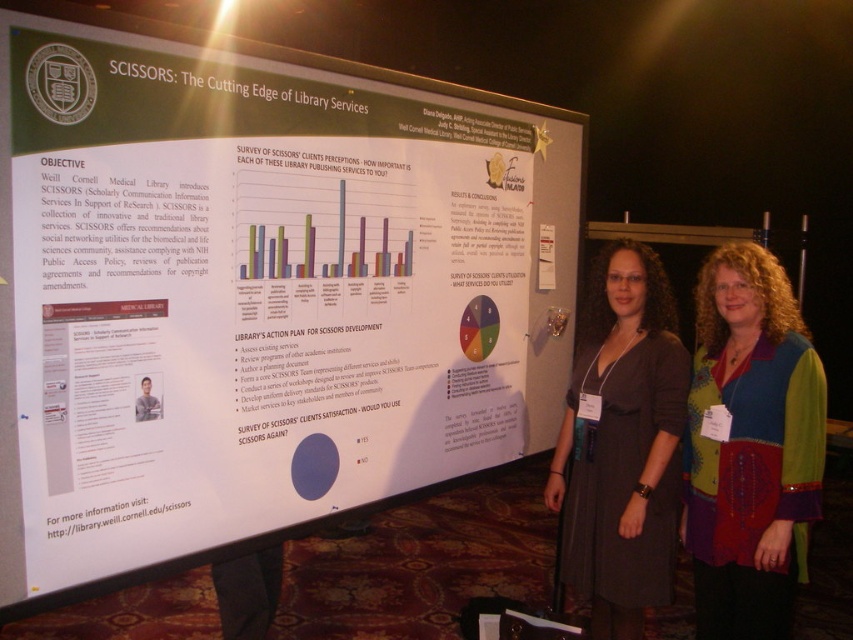
Question: Estimate the real-world distances between objects in this image. Which object is farther from the matte gray dress at center?

Choices:
 (A) white paperboard at center
 (B) multicolored patchwork blouse at center

Answer: (A)

Question: Which object is the closest to the multicolored patchwork blouse at center?

Choices:
 (A) white paperboard at center
 (B) matte gray dress at center

Answer: (B)

Question: Considering the relative positions of white paperboard at center and matte gray dress at center in the image provided, where is white paperboard at center located with respect to matte gray dress at center?

Choices:
 (A) above
 (B) below

Answer: (A)

Question: Which object is positioned closest to the matte gray dress at center?

Choices:
 (A) white paperboard at center
 (B) multicolored patchwork blouse at center

Answer: (B)

Question: From the image, what is the correct spatial relationship of multicolored patchwork blouse at center in relation to matte gray dress at center?

Choices:
 (A) below
 (B) above

Answer: (A)

Question: Can you confirm if multicolored patchwork blouse at center is bigger than matte gray dress at center?

Choices:
 (A) yes
 (B) no

Answer: (B)